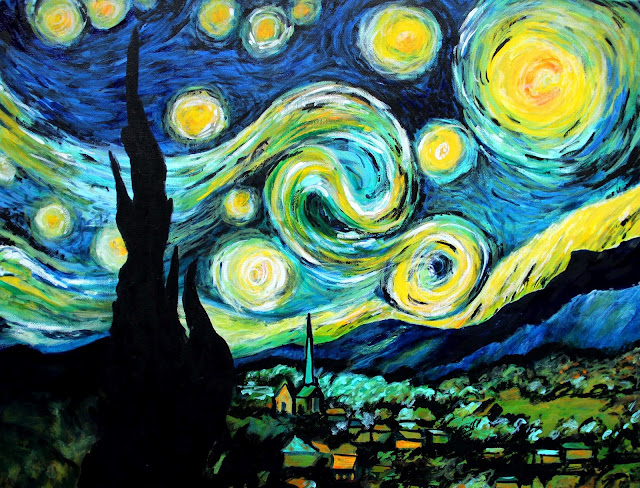
The height and width of the screenshot is (488, 640). In order to click on trees in painting in this screenshot , I will do `click(521, 455)`, `click(483, 437)`, `click(390, 467)`, `click(603, 451)`, `click(543, 391)`, `click(40, 432)`.